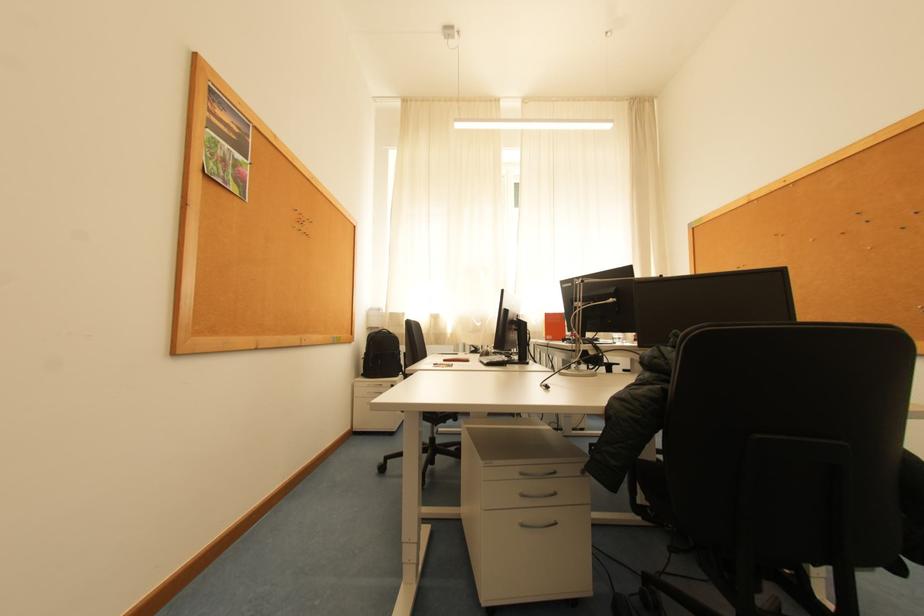
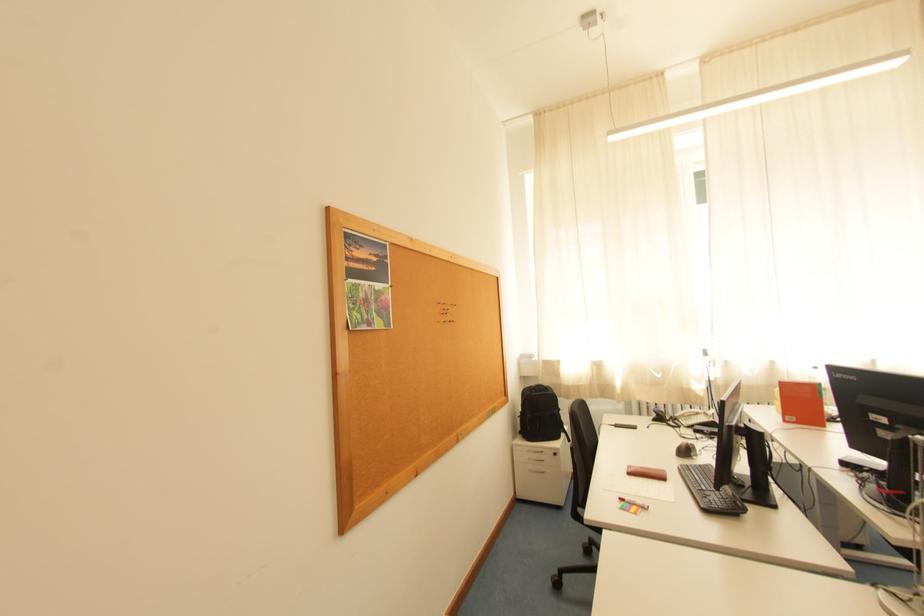
In the second image, find the point that corresponds to the point at 371,377 in the first image.

(528, 434)